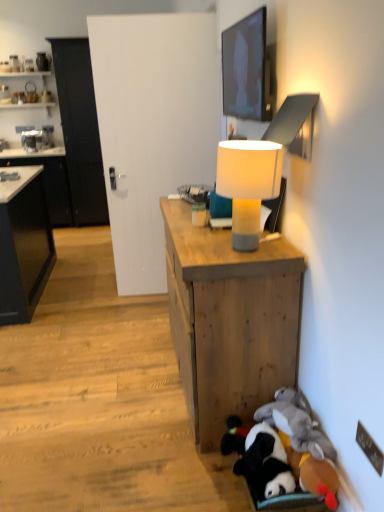
Question: From the image's perspective, relative to fluffy plush toys at lower right, is black glossy cabinet at left, positioned as the 1th cabinetry in right-to-left order, above or below?

Choices:
 (A) above
 (B) below

Answer: (A)

Question: Which is correct: black glossy cabinet at left, the 2th cabinetry from the left, is inside fluffy plush toys at lower right, or outside of it?

Choices:
 (A) inside
 (B) outside

Answer: (B)

Question: Estimate the real-world distances between objects in this image. Which object is closer to the black matte cabinet at left, the 2th cabinetry positioned from the right?

Choices:
 (A) wooden desk at center
 (B) black glossy cabinet at left, positioned as the 1th cabinetry in right-to-left order
 (C) fluffy plush toys at lower right
 (D) matte black tv at upper center
 (E) white fabric lampshade at center

Answer: (B)

Question: Which of these objects is positioned closest to the black matte cabinet at left, marked as the 1th cabinetry in a left-to-right arrangement?

Choices:
 (A) black glossy cabinet at left, the 2th cabinetry from the left
 (B) white fabric lampshade at center
 (C) matte black tv at upper center
 (D) fluffy plush toys at lower right
 (E) wooden desk at center

Answer: (A)